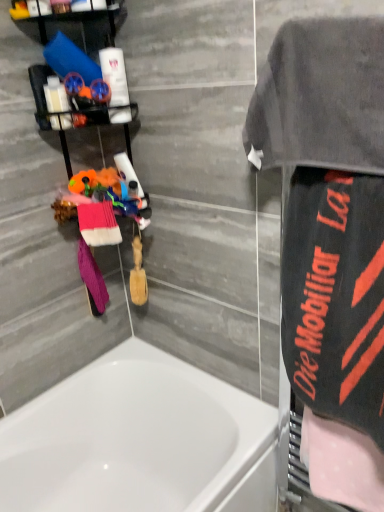
Question: Is pink polka dot towel at right, acting as the 5th beach towel starting from the left, in front of or behind gray terry cloth towel at upper right in the image?

Choices:
 (A) front
 (B) behind

Answer: (B)

Question: Visually, is pink polka dot towel at right, acting as the 5th beach towel starting from the left, positioned to the left or to the right of gray terry cloth towel at upper right?

Choices:
 (A) left
 (B) right

Answer: (B)

Question: Which of these objects is positioned farthest from the matte plastic bottles at upper left, the 1th toiletry from the left?

Choices:
 (A) pink terry cloth beach towel at left, which is counted as the second beach towel, starting from the left
 (B) purple knitted towel at lower left, marked as the first beach towel in a left-to-right arrangement
 (C) white glossy lotion at upper left, positioned as the 1th toiletry in right-to-left order
 (D) white glossy bathtub at lower left
 (E) gray terry cloth towel at upper right

Answer: (D)

Question: Estimate the real-world distances between objects in this image. Which object is farther from the black fabric towel at right, marked as the 2th beach towel in a right-to-left arrangement?

Choices:
 (A) matte plastic bottles at upper left, the 1th toiletry from the left
 (B) gray terry cloth towel at upper right
 (C) gray terry cloth towel at upper right, acting as the 3th beach towel starting from the left
 (D) pink polka dot towel at right, the 1th beach towel when ordered from right to left
 (E) white glossy lotion at upper left, the 2th toiletry positioned from the left

Answer: (A)